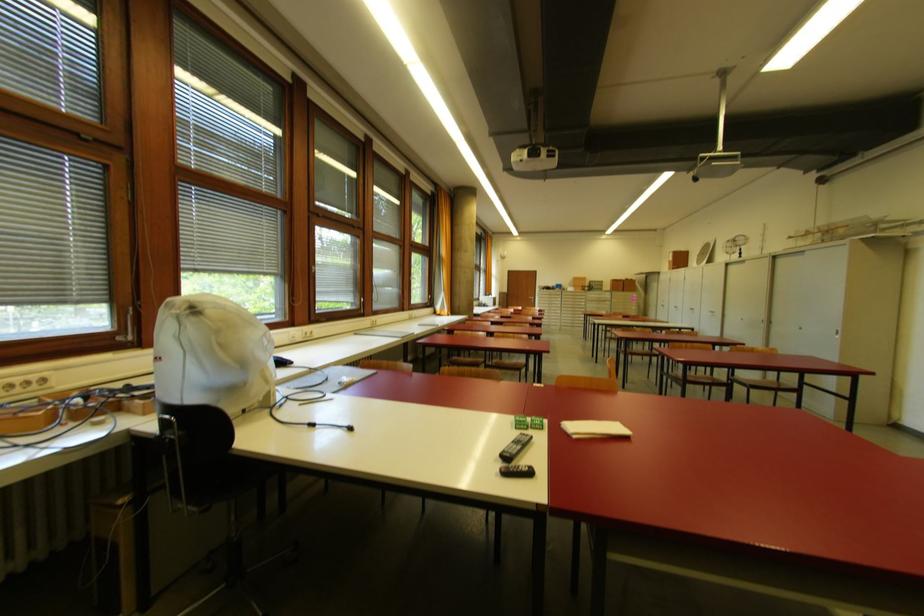
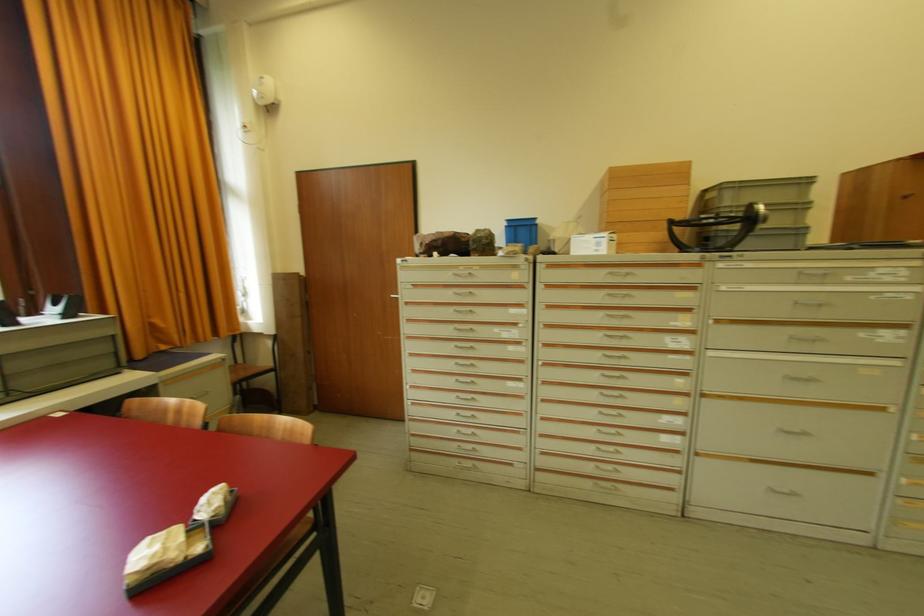
The point at (604,283) is marked in the first image. Where is the corresponding point in the second image?

(809, 184)